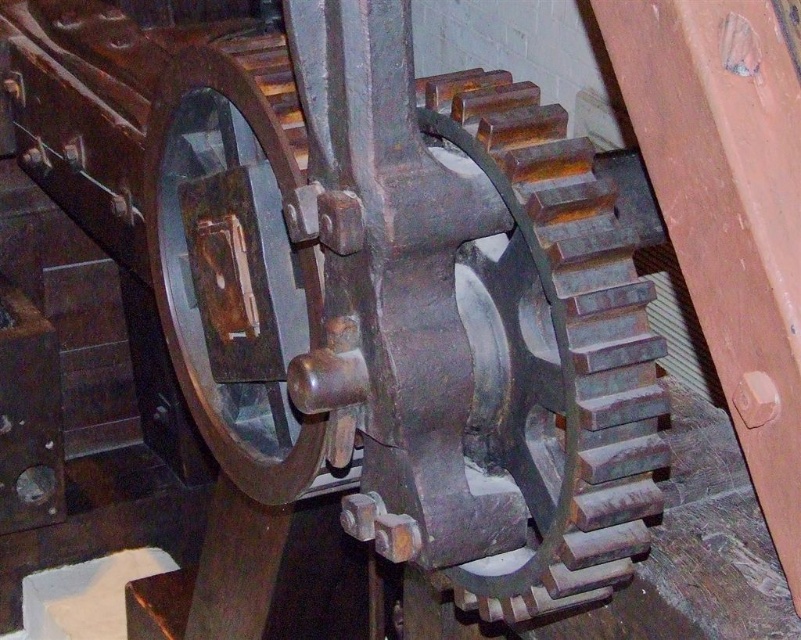
Question: Which point is farther to the camera?

Choices:
 (A) (552, 227)
 (B) (155, 253)

Answer: (B)

Question: Which of the following is the closest to the observer?

Choices:
 (A) (372, 321)
 (B) (210, 193)

Answer: (A)

Question: Does rusty metal gear at center appear on the right side of metallic polished wheel at center?

Choices:
 (A) no
 (B) yes

Answer: (B)

Question: Can you confirm if rusty metal gear at center is positioned above metallic polished wheel at center?

Choices:
 (A) no
 (B) yes

Answer: (A)

Question: Which point appears closest to the camera in this image?

Choices:
 (A) (244, 193)
 (B) (514, 548)

Answer: (B)

Question: Is rusty metal gear at center to the right of metallic polished wheel at center from the viewer's perspective?

Choices:
 (A) yes
 (B) no

Answer: (A)